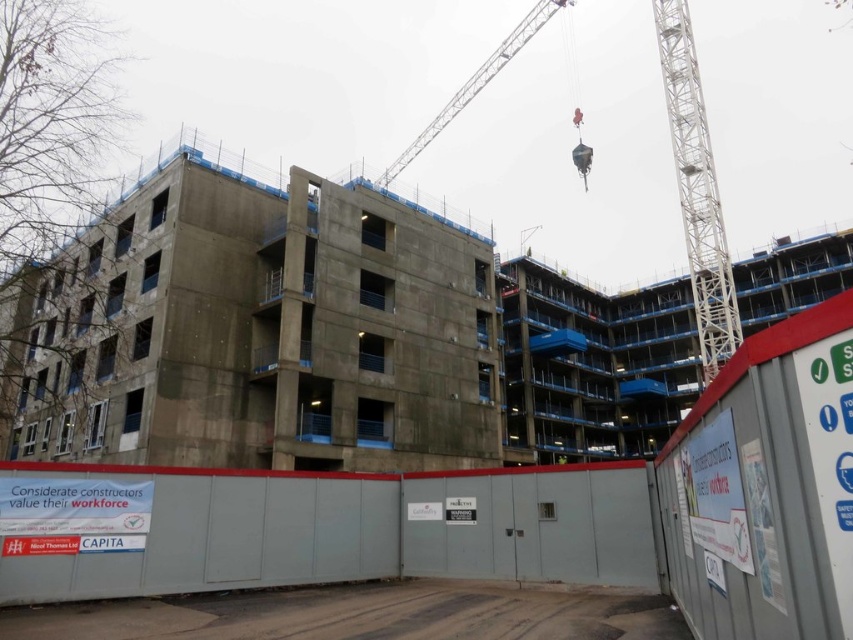
Question: Does white metallic crane at upper right have a larger size compared to metallic silver crane at upper center?

Choices:
 (A) yes
 (B) no

Answer: (B)

Question: Which of the following is the farthest from the observer?

Choices:
 (A) (471, 97)
 (B) (734, 332)

Answer: (A)

Question: In this image, where is white metallic crane at upper center located relative to metallic silver crane at upper center?

Choices:
 (A) below
 (B) above

Answer: (A)

Question: Among these objects, which one is farthest from the camera?

Choices:
 (A) white metallic crane at upper center
 (B) metallic silver crane at upper center

Answer: (B)

Question: Does white metallic crane at upper center appear on the right side of metallic silver crane at upper center?

Choices:
 (A) yes
 (B) no

Answer: (A)

Question: Which object is the farthest from the white metallic crane at upper right?

Choices:
 (A) white metallic crane at upper center
 (B) metallic silver crane at upper center

Answer: (B)